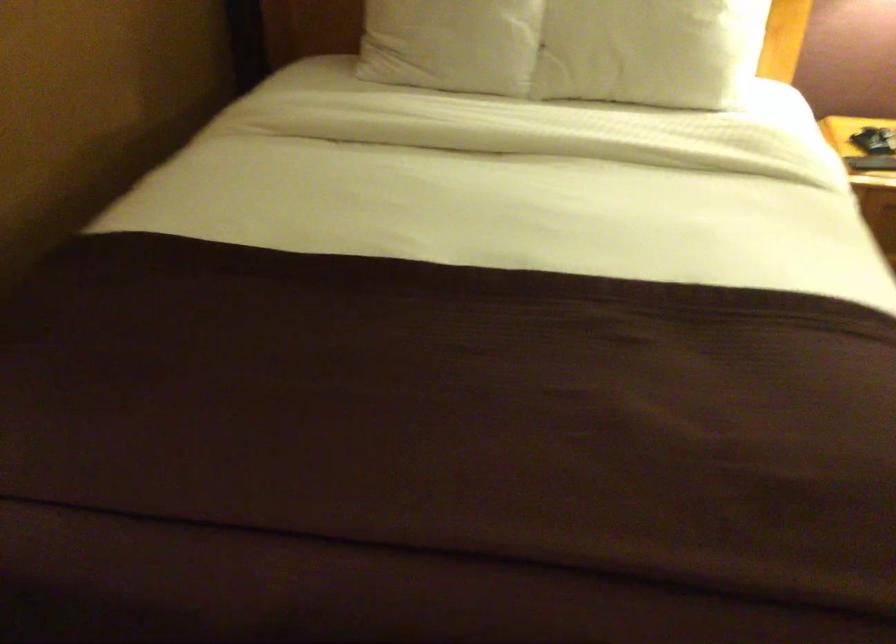
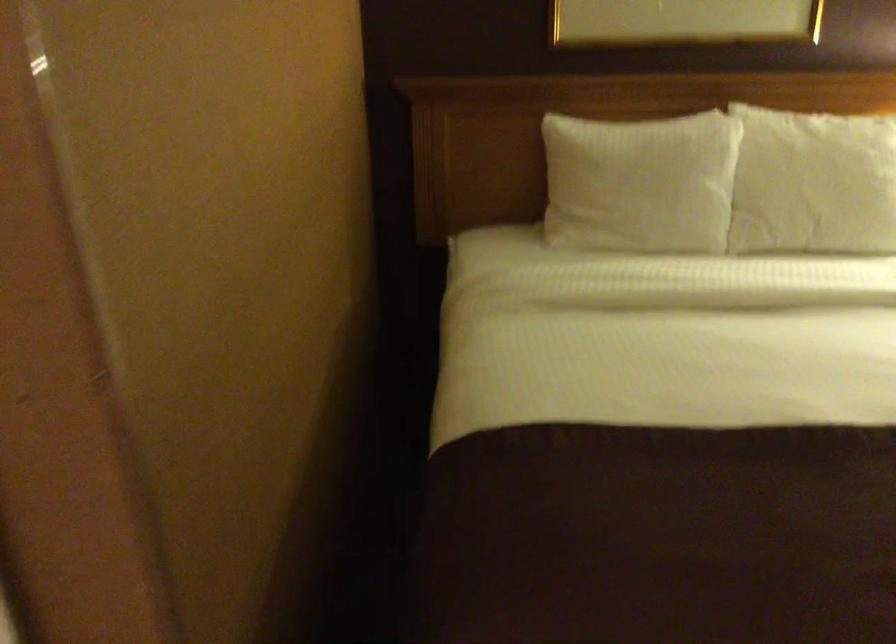
Question: Which direction would the cameraman need to move to produce the second image? Reply with the corresponding letter.

Choices:
 (A) Left
 (B) Right
 (C) Forward
 (D) Backward

Answer: (A)